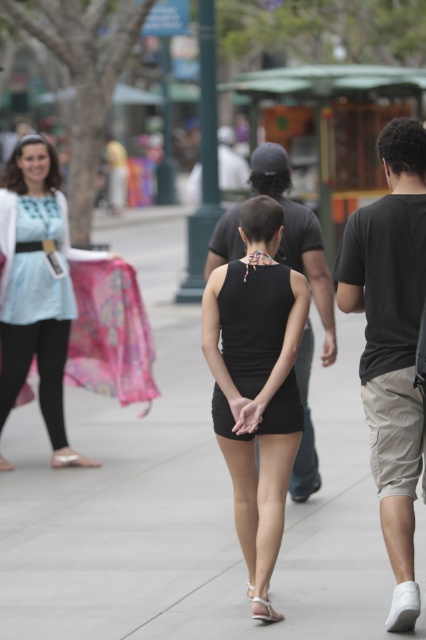
Can you confirm if black matte dress at center is positioned below white leather sandal at lower center?

No.

Can you confirm if black matte dress at center is wider than white leather sandal at lower center?

Yes.

What do you see at coordinates (253, 321) in the screenshot? I see `black matte dress at center` at bounding box center [253, 321].

I want to click on black matte dress at center, so click(253, 321).

Measure the distance between black matte dress at center and camera.

The distance of black matte dress at center from camera is 6.31 meters.

Which is behind, point (216, 419) or point (256, 611)?

Positioned behind is point (216, 419).

This screenshot has width=426, height=640. What are the coordinates of `black matte dress at center` in the screenshot? It's located at (253, 321).

In the scene shown: Who is positioned more to the right, dark gray t-shirt at right or white leather sandal at center?

dark gray t-shirt at right

Can you confirm if dark gray t-shirt at right is thinner than white leather sandal at center?

No.

Where is `dark gray t-shirt at right`? This screenshot has width=426, height=640. dark gray t-shirt at right is located at coordinates (391, 342).

Identify the location of dark gray t-shirt at right. (391, 342).